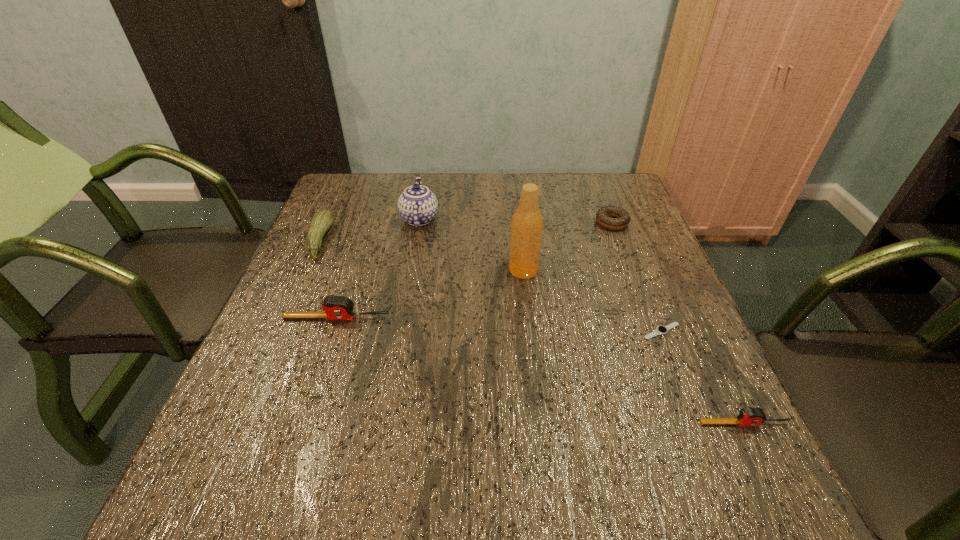
This screenshot has width=960, height=540. Find the location of `free spot at the right edge of the desktop`. free spot at the right edge of the desktop is located at coordinates [x=666, y=345].

Find the location of a particular element. free region at the far left corner of the desktop is located at coordinates (375, 202).

Where is `vacant space at the far right corner`? vacant space at the far right corner is located at coordinates (627, 197).

In the image, there is a desktop. At what (x,y) coordinates should I click in order to perform the action: click on free region at the near right corner. Please return your answer as a coordinate pair (x, y). Image resolution: width=960 pixels, height=540 pixels. Looking at the image, I should click on (673, 399).

Locate an element on the screen. Image resolution: width=960 pixels, height=540 pixels. vacant point located between the taller tape measure and the zucchini is located at coordinates (328, 279).

Image resolution: width=960 pixels, height=540 pixels. I want to click on free space between the sixth shortest object and the nearer tape measure, so click(x=582, y=321).

Where is `free space between the nearest object and the chinaware`? This screenshot has width=960, height=540. free space between the nearest object and the chinaware is located at coordinates (582, 321).

This screenshot has height=540, width=960. In order to click on blank region between the farther tape measure and the chinaware in this screenshot , I will do `click(378, 268)`.

Find the location of a particular element. The width and height of the screenshot is (960, 540). free space between the farther tape measure and the second tallest object is located at coordinates (378, 268).

Where is `vacant point located between the left tape measure and the chinaware`? The image size is (960, 540). vacant point located between the left tape measure and the chinaware is located at coordinates (378, 268).